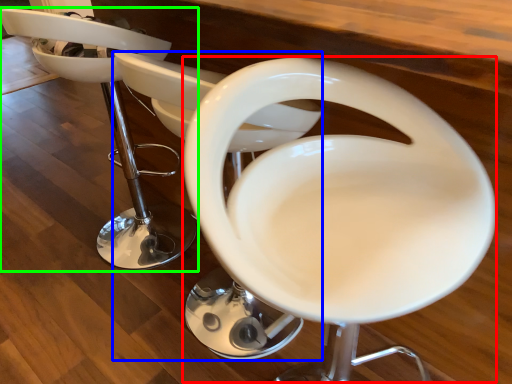
Question: Which object is positioned closest to feeding chair (highlighted by a red box)? Select from feeding chair (highlighted by a blue box) and chair (highlighted by a green box).

Choices:
 (A) feeding chair
 (B) chair

Answer: (A)